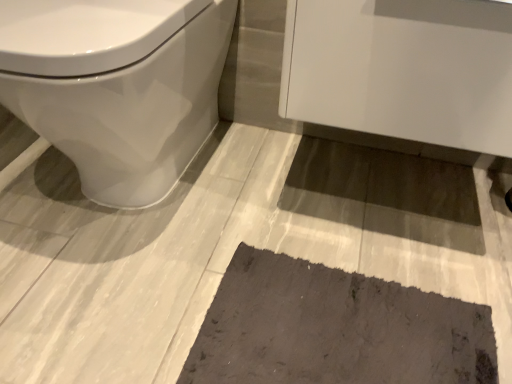
Question: Is white glossy cabinet at upper right to the right of dark gray textured bath mat at lower center from the viewer's perspective?

Choices:
 (A) yes
 (B) no

Answer: (A)

Question: Considering the relative sizes of white glossy cabinet at upper right and dark gray textured bath mat at lower center in the image provided, is white glossy cabinet at upper right shorter than dark gray textured bath mat at lower center?

Choices:
 (A) no
 (B) yes

Answer: (A)

Question: Can dark gray textured bath mat at lower center be found inside white glossy cabinet at upper right?

Choices:
 (A) no
 (B) yes

Answer: (A)

Question: Can you confirm if white glossy cabinet at upper right is wider than dark gray textured bath mat at lower center?

Choices:
 (A) no
 (B) yes

Answer: (B)

Question: Are white glossy cabinet at upper right and dark gray textured bath mat at lower center making contact?

Choices:
 (A) no
 (B) yes

Answer: (A)

Question: Is white glossy cabinet at upper right smaller than dark gray textured bath mat at lower center?

Choices:
 (A) no
 (B) yes

Answer: (A)

Question: Is white glossy toilet at left at the back of dark gray textured bath mat at lower center?

Choices:
 (A) no
 (B) yes

Answer: (A)

Question: Does dark gray textured bath mat at lower center touch white glossy toilet at left?

Choices:
 (A) no
 (B) yes

Answer: (A)

Question: Considering the relative positions of dark gray textured bath mat at lower center and white glossy toilet at left in the image provided, is dark gray textured bath mat at lower center behind white glossy toilet at left?

Choices:
 (A) yes
 (B) no

Answer: (A)

Question: Could you tell me if dark gray textured bath mat at lower center is turned towards white glossy toilet at left?

Choices:
 (A) no
 (B) yes

Answer: (A)

Question: Considering the relative positions of dark gray textured bath mat at lower center and white glossy toilet at left in the image provided, is dark gray textured bath mat at lower center to the right of white glossy toilet at left from the viewer's perspective?

Choices:
 (A) no
 (B) yes

Answer: (B)

Question: Is dark gray textured bath mat at lower center shorter than white glossy toilet at left?

Choices:
 (A) no
 (B) yes

Answer: (B)

Question: Is dark gray textured bath mat at lower center closer to the viewer compared to white glossy cabinet at upper right?

Choices:
 (A) yes
 (B) no

Answer: (B)